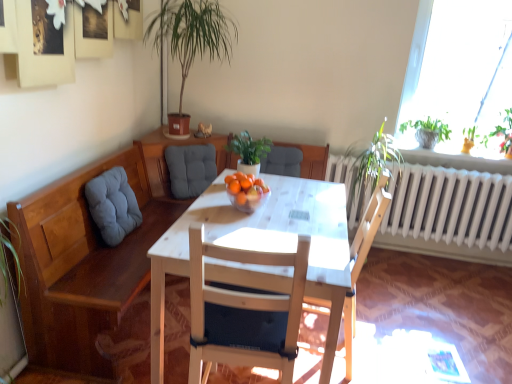
Question: Which direction should I rotate to face white wood chair at center, positioned as the 4th chair in back-to-front order, — up or down?

Choices:
 (A) down
 (B) up

Answer: (A)

Question: Which direction should I rotate to look at green matte plant at center, which is the second houseplant in top-to-bottom order, — up or down?

Choices:
 (A) down
 (B) up

Answer: (B)

Question: From a real-world perspective, is green leafy plant at upper right on green matte plant at center, which ranks as the 1th houseplant in bottom-to-top order?

Choices:
 (A) no
 (B) yes

Answer: (B)

Question: Could you tell me if green leafy plant at upper right is facing green matte plant at center, which is the second houseplant in top-to-bottom order?

Choices:
 (A) yes
 (B) no

Answer: (B)

Question: From the image's perspective, does green leafy plant at upper right appear higher than green matte plant at center, which ranks as the 1th houseplant in bottom-to-top order?

Choices:
 (A) yes
 (B) no

Answer: (A)

Question: Is green leafy plant at upper right shorter than green matte plant at center, which ranks as the 1th houseplant in bottom-to-top order?

Choices:
 (A) no
 (B) yes

Answer: (A)

Question: Considering the relative sizes of green leafy plant at upper right and green matte plant at center, which is the second houseplant in top-to-bottom order, in the image provided, is green leafy plant at upper right taller than green matte plant at center, which is the second houseplant in top-to-bottom order,?

Choices:
 (A) yes
 (B) no

Answer: (A)

Question: Is green leafy plant at upper right directly adjacent to green matte plant at center, which is the second houseplant in top-to-bottom order?

Choices:
 (A) no
 (B) yes

Answer: (A)

Question: From the image's perspective, is white wood chair at center, positioned as the 4th chair in back-to-front order, on top of green leafy plant at upper right?

Choices:
 (A) no
 (B) yes

Answer: (A)

Question: Is white wood chair at center, which ranks as the 1th chair in front-to-back order, facing towards green leafy plant at upper right?

Choices:
 (A) no
 (B) yes

Answer: (A)

Question: Is white wood chair at center, positioned as the 4th chair in back-to-front order, at the right side of green leafy plant at upper right?

Choices:
 (A) no
 (B) yes

Answer: (A)

Question: From a real-world perspective, does white wood chair at center, which ranks as the 1th chair in front-to-back order, sit lower than green leafy plant at upper right?

Choices:
 (A) no
 (B) yes

Answer: (B)

Question: Is white wood chair at center, positioned as the 4th chair in back-to-front order, oriented away from green leafy plant at upper right?

Choices:
 (A) no
 (B) yes

Answer: (A)

Question: Are white wood chair at center, which ranks as the 1th chair in front-to-back order, and green leafy plant at upper right located far from each other?

Choices:
 (A) yes
 (B) no

Answer: (A)

Question: Is green matte plant at center, which ranks as the 1th houseplant in bottom-to-top order, smaller than green leafy plant at upper right?

Choices:
 (A) yes
 (B) no

Answer: (A)